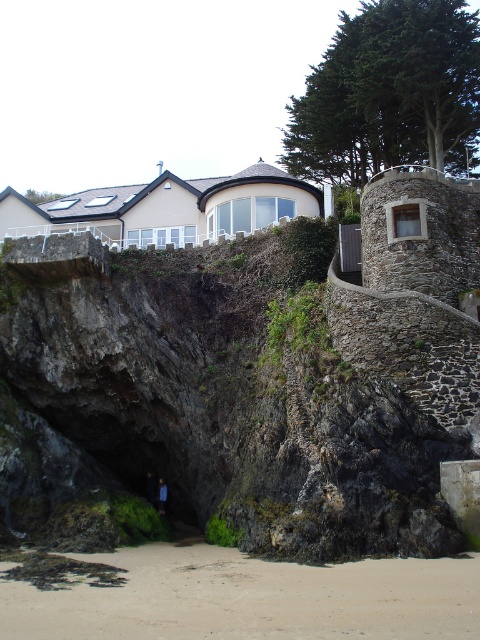
You are standing at the base of the cliff looking up at the house. There are two points marked on the cliff wall. The first point is at coordinates point (162, 328) and the second is at point (159, 486). Which point is closer to you?

Point (162, 328) is in front of point (159, 486), so it is closer to you.

You are standing on the light brown sandy beach at lower center and want to reach the rustic stone castle at center. Which direction should you walk to get closer to the castle?

You should walk towards the direction of the rustic stone castle at center since it is further away from you compared to the light brown sandy beach at lower center where you are standing.